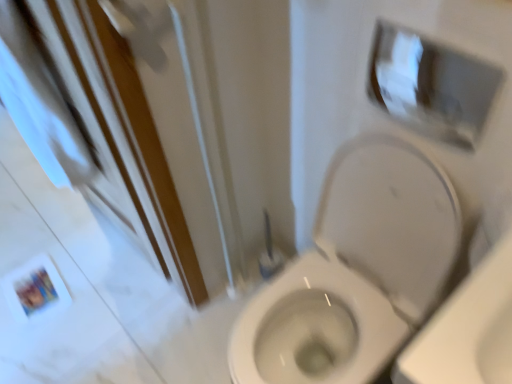
What do you see at coordinates (356, 270) in the screenshot? The height and width of the screenshot is (384, 512). I see `white glossy toilet at center` at bounding box center [356, 270].

Identify the location of white glossy medicine cabinet at upper right. (430, 85).

You are a GUI agent. You are given a task and a screenshot of the screen. Output one action in this format:
    pyautogui.click(x=<x>, y=<y>)
    Task: Click on the white glossy toilet at center
    
    Given the screenshot: What is the action you would take?
    pyautogui.click(x=356, y=270)

Is white fabric screen door at lower left not near white glossy toilet at center?

white fabric screen door at lower left is actually quite close to white glossy toilet at center.

Is white fabric screen door at lower left taller or shorter than white glossy toilet at center?

In the image, white fabric screen door at lower left appears to be taller than white glossy toilet at center.

From a real-world perspective, is white fabric screen door at lower left above or below white glossy toilet at center?

In terms of real-world spatial position, white fabric screen door at lower left is above white glossy toilet at center.

From the image's perspective, is white fabric screen door at lower left above or below white glossy toilet at center?

From the image's perspective, white fabric screen door at lower left appears above white glossy toilet at center.

Considering the relative sizes of white glossy toilet at center and white fabric screen door at lower left in the image provided, is white glossy toilet at center bigger than white fabric screen door at lower left?

Correct, white glossy toilet at center is larger in size than white fabric screen door at lower left.

Which object is closer to the camera, white glossy toilet at center or white fabric screen door at lower left?

Positioned in front is white fabric screen door at lower left.

Consider the image. From the image's perspective, is white glossy toilet at center positioned above or below white fabric screen door at lower left?

From the image's perspective, white glossy toilet at center appears below white fabric screen door at lower left.

This screenshot has width=512, height=384. Find the location of `screen door above the white glossy toilet at center (from a real-world perspective)`. screen door above the white glossy toilet at center (from a real-world perspective) is located at coordinates (94, 124).

Is white glossy medicine cabinet at upper right oriented away from white glossy toilet at center?

That's not correct — white glossy medicine cabinet at upper right is not looking away from white glossy toilet at center.

Can you confirm if white glossy medicine cabinet at upper right is taller than white glossy toilet at center?

No.

From a real-world perspective, which object rests below the other?

white glossy toilet at center.

From the picture: Is white glossy medicine cabinet at upper right located outside white fabric screen door at lower left?

white glossy medicine cabinet at upper right lies outside white fabric screen door at lower left's area.

Which object is positioned more to the right, white glossy medicine cabinet at upper right or white fabric screen door at lower left?

Positioned to the right is white glossy medicine cabinet at upper right.

Is white glossy medicine cabinet at upper right oriented away from white fabric screen door at lower left?

No.

What's the angular difference between white glossy medicine cabinet at upper right and white fabric screen door at lower left's facing directions?

The angle between the facing direction of white glossy medicine cabinet at upper right and the facing direction of white fabric screen door at lower left is 91.1 degrees.

Does white glossy toilet at center have a larger size compared to white glossy medicine cabinet at upper right?

Yes, white glossy toilet at center is bigger than white glossy medicine cabinet at upper right.

Which is in front, point (337, 355) or point (397, 80)?

The point (397, 80) is closer to the camera.

From a real-world perspective, is white glossy toilet at center beneath white glossy medicine cabinet at upper right?

Yes, from a real-world perspective, white glossy toilet at center is under white glossy medicine cabinet at upper right.

Which is behind, white glossy toilet at center or white glossy medicine cabinet at upper right?

white glossy medicine cabinet at upper right is further away from the camera.

Is white fabric screen door at lower left positioned beyond the bounds of white glossy medicine cabinet at upper right?

white fabric screen door at lower left lies outside white glossy medicine cabinet at upper right's area.

Looking at the image, does white fabric screen door at lower left seem bigger or smaller compared to white glossy medicine cabinet at upper right?

white fabric screen door at lower left is bigger than white glossy medicine cabinet at upper right.

Is white fabric screen door at lower left far from white glossy medicine cabinet at upper right?

Actually, white fabric screen door at lower left and white glossy medicine cabinet at upper right are a little close together.

The height and width of the screenshot is (384, 512). What are the coordinates of `toilet behind the white fabric screen door at lower left` in the screenshot? It's located at (356, 270).

The height and width of the screenshot is (384, 512). In order to click on screen door on the left of the white glossy toilet at center in this screenshot , I will do `click(94, 124)`.

From the image, which object appears to be nearer to white glossy toilet at center, white fabric screen door at lower left or white glossy medicine cabinet at upper right?

Among the two, white glossy medicine cabinet at upper right is located nearer to white glossy toilet at center.

Looking at the image, which one is located further to white glossy toilet at center, white glossy medicine cabinet at upper right or white fabric screen door at lower left?

white fabric screen door at lower left.

When comparing their distances from white fabric screen door at lower left, does white glossy toilet at center or white glossy medicine cabinet at upper right seem further?

The object further to white fabric screen door at lower left is white glossy medicine cabinet at upper right.

When comparing their distances from white glossy medicine cabinet at upper right, does white fabric screen door at lower left or white glossy toilet at center seem closer?

Among the two, white glossy toilet at center is located nearer to white glossy medicine cabinet at upper right.

From the image, which object appears to be nearer to white fabric screen door at lower left, white glossy medicine cabinet at upper right or white glossy toilet at center?

white glossy toilet at center is positioned closer to the anchor white fabric screen door at lower left.

Estimate the real-world distances between objects in this image. Which object is further from white glossy medicine cabinet at upper right, white glossy toilet at center or white fabric screen door at lower left?

white fabric screen door at lower left is positioned further to the anchor white glossy medicine cabinet at upper right.

Locate an element on the screen. The width and height of the screenshot is (512, 384). toilet situated between white fabric screen door at lower left and white glossy medicine cabinet at upper right from left to right is located at coordinates (356, 270).